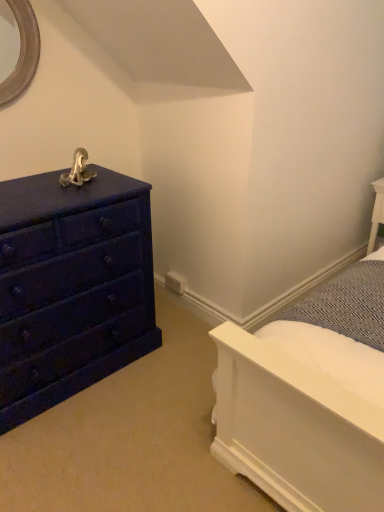
Where is `vacant area on top of white textured fabric at upper right (from a real-world perspective)`? Image resolution: width=384 pixels, height=512 pixels. vacant area on top of white textured fabric at upper right (from a real-world perspective) is located at coordinates (306, 280).